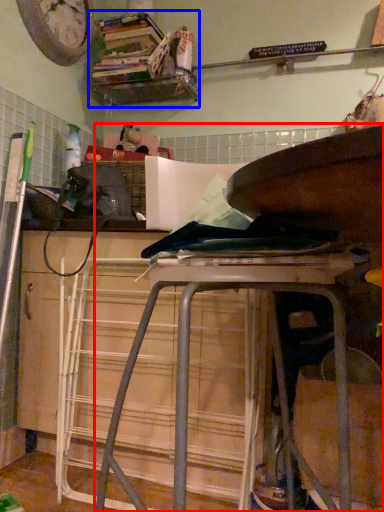
Question: Which object is closer to the camera taking this photo, furniture (highlighted by a red box) or shelf (highlighted by a blue box)?

Choices:
 (A) furniture
 (B) shelf

Answer: (A)